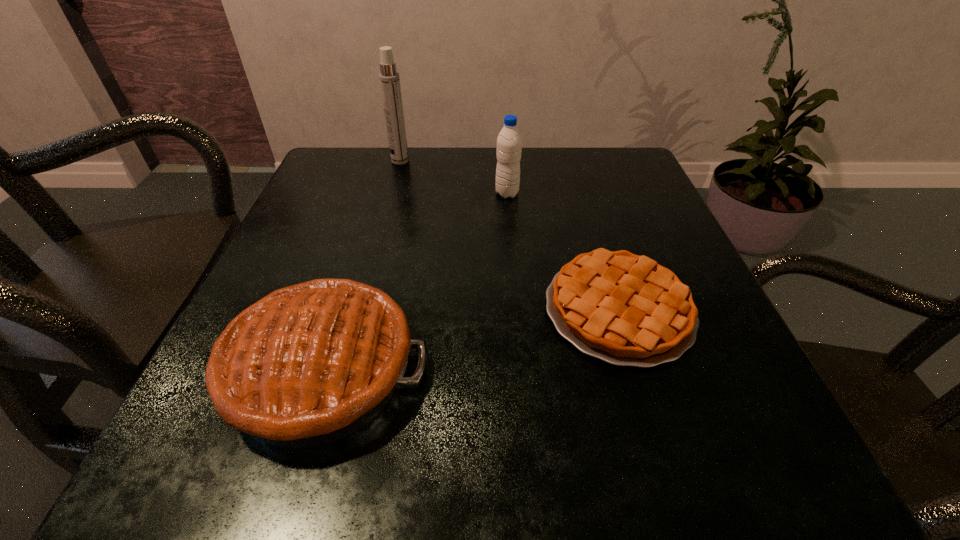
Locate an element on the screen. free space between the aerosol can and the second farthest object is located at coordinates (454, 177).

Locate an element on the screen. The width and height of the screenshot is (960, 540). vacant space that's between the shorter pie and the second shortest object is located at coordinates (470, 340).

I want to click on free spot between the left pie and the third shortest object, so click(x=415, y=282).

Find the location of `unoccupied position between the rightmost object and the second shortest object`. unoccupied position between the rightmost object and the second shortest object is located at coordinates (470, 340).

Where is `free space between the tallest object and the shorter pie`? free space between the tallest object and the shorter pie is located at coordinates (510, 235).

Find the location of `the closest object to the tallest object`. the closest object to the tallest object is located at coordinates (509, 142).

Select which object appears as the second closest to the taller pie. Please provide its 2D coordinates. Your answer should be formatted as a tuple, i.e. [(x, y)], where the tuple contains the x and y coordinates of a point satisfying the conditions above.

[(509, 142)]

Image resolution: width=960 pixels, height=540 pixels. I want to click on free space that satisfies the following two spatial constraints: 1. on the front side of the water bottle; 2. on the right side of the aerosol can, so click(x=392, y=193).

You are a GUI agent. You are given a task and a screenshot of the screen. Output one action in this format:
    pyautogui.click(x=<x>, y=<y>)
    Task: Click on the free spot that satisfies the following two spatial constraints: 1. on the back side of the taller pie; 2. on the left side of the aerosol can
    This screenshot has width=960, height=540.
    Given the screenshot: What is the action you would take?
    pyautogui.click(x=388, y=161)

I want to click on free location that satisfies the following two spatial constraints: 1. on the front side of the third nearest object; 2. on the right side of the tallest object, so pyautogui.click(x=392, y=193).